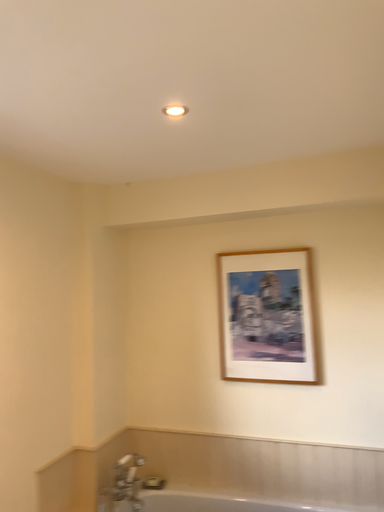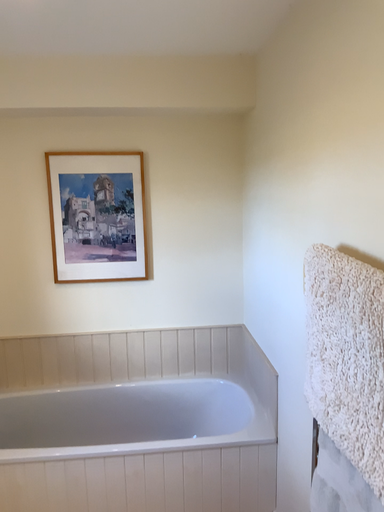
Question: How did the camera likely rotate when shooting the video?

Choices:
 (A) rotated upward
 (B) rotated downward

Answer: (B)